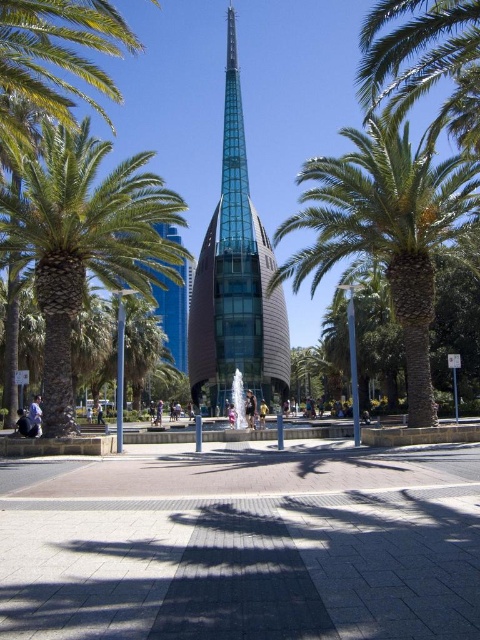
Question: Considering the real-world distances, which object is closest to the transparent glass spire at center?

Choices:
 (A) green leafy palm tree at left
 (B) green leafy palm tree at center

Answer: (B)

Question: Which point is closer to the camera taking this photo?

Choices:
 (A) (227, 316)
 (B) (468, 176)
 (C) (165, 272)

Answer: (B)

Question: Does green leafy palm tree at center appear under transparent glass spire at center?

Choices:
 (A) yes
 (B) no

Answer: (A)

Question: Observing the image, what is the correct spatial positioning of green leafy palm tree at left in reference to transparent glass spire at center?

Choices:
 (A) right
 (B) left

Answer: (B)

Question: Which object is farther from the camera taking this photo?

Choices:
 (A) transparent glass spire at center
 (B) green leafy palm tree at center
 (C) green leafy palm tree at left

Answer: (A)

Question: Is green leafy palm tree at left to the right of green leafy palm tree at center from the viewer's perspective?

Choices:
 (A) yes
 (B) no

Answer: (B)